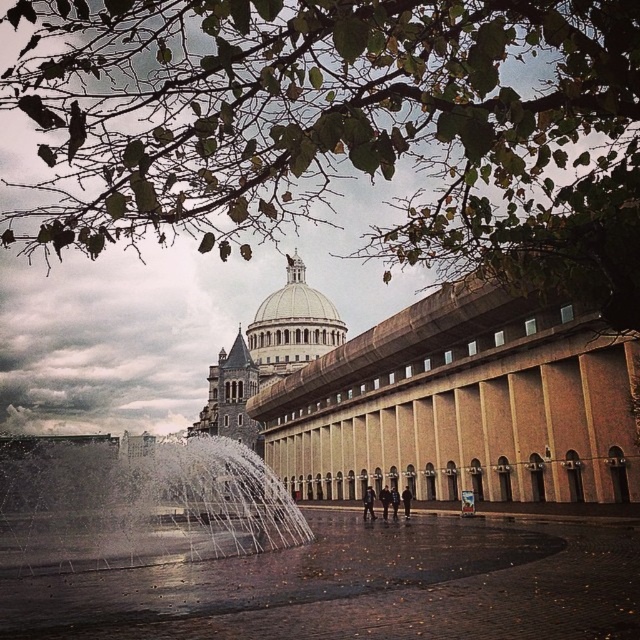
You are standing at the edge of the square facing the cathedral. You see the white water at center and the dark brown leather jacket at center. Which object is closer to the right side of the square?

The dark brown leather jacket at center is closer to the right side of the square because the white water at center is to the left of it.

You are standing in the square in front of the cathedral and see the dark blue jeans at center and the dark gray fabric coat at center. Which item is larger in size?

The dark blue jeans at center is bigger than the dark gray fabric coat at center.

You are standing in front of the grand architectural structure and notice two items in the center of the scene. Which one is taller, the dark blue jeans at center or the dark gray fabric coat at center?

The dark blue jeans at center is taller than the dark gray fabric coat at center according to the description.